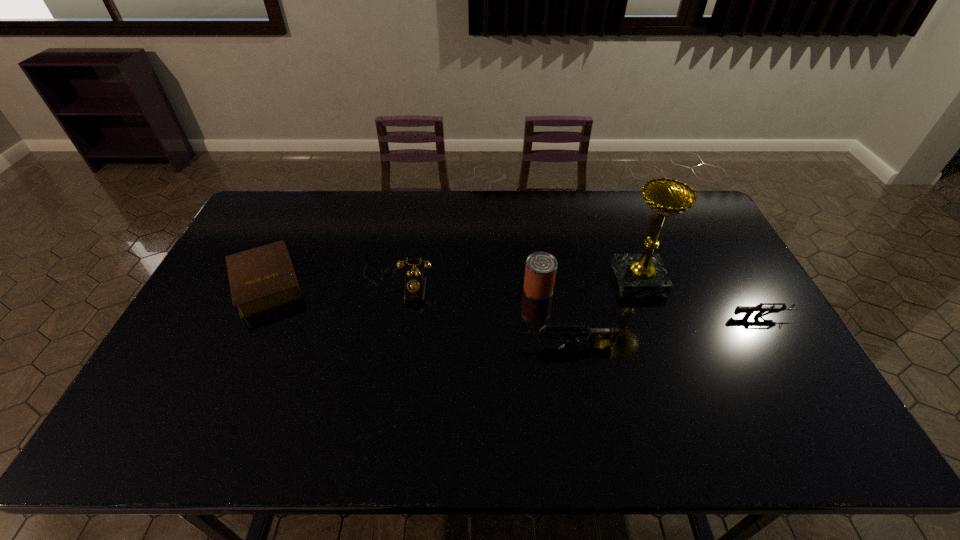
Identify the location of unoccupied position between the telephone and the can. The width and height of the screenshot is (960, 540). (468, 285).

Identify the location of vacant point located between the leftmost object and the can. (402, 286).

Identify the location of unoccupied area between the telephone and the farther gun. (580, 299).

Where is `the closest object to the left gun`? Image resolution: width=960 pixels, height=540 pixels. the closest object to the left gun is located at coordinates (540, 271).

Point out which object is positioned as the fifth nearest to the second object from left to right. Please provide its 2D coordinates. Your answer should be formatted as a tuple, i.e. [(x, y)], where the tuple contains the x and y coordinates of a point satisfying the conditions above.

[(749, 310)]

This screenshot has height=540, width=960. In order to click on free location that satisfies the following two spatial constraints: 1. on the dial of the can; 2. on the left side of the telephone in this screenshot , I will do `click(396, 289)`.

Identify the location of vacant area that satisfies the following two spatial constraints: 1. on the front-facing side of the second object from right to left; 2. on the dial of the fifth object from right to left. (639, 281).